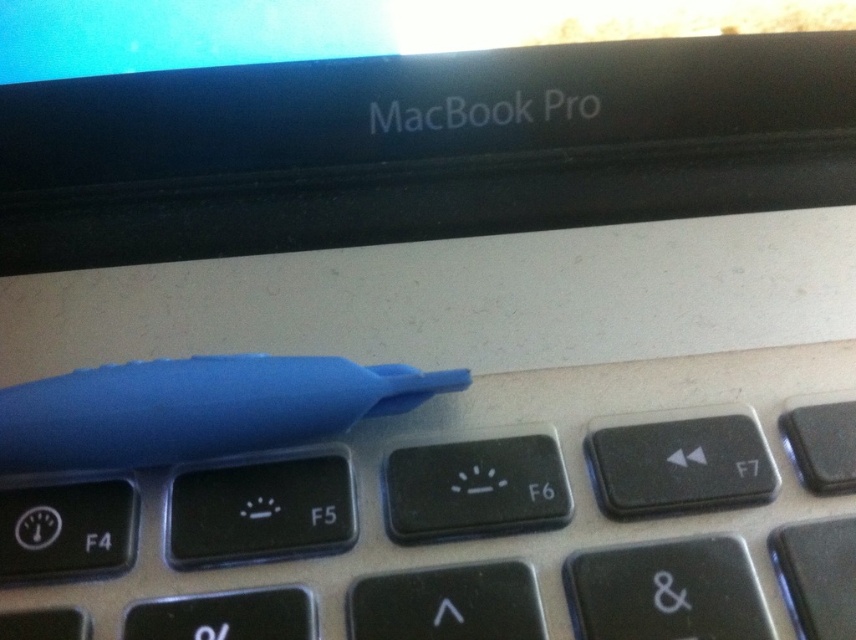
Question: Is blue rubber pen at upper center wider than blue rubber pen at center?

Choices:
 (A) yes
 (B) no

Answer: (A)

Question: In this image, where is blue rubber pen at upper center located relative to blue rubber pen at center?

Choices:
 (A) above
 (B) below

Answer: (B)

Question: Can you confirm if blue rubber pen at upper center is positioned to the right of blue rubber pen at center?

Choices:
 (A) yes
 (B) no

Answer: (A)

Question: Which object is closer to the camera taking this photo?

Choices:
 (A) blue rubber pen at center
 (B) blue rubber pen at upper center

Answer: (B)